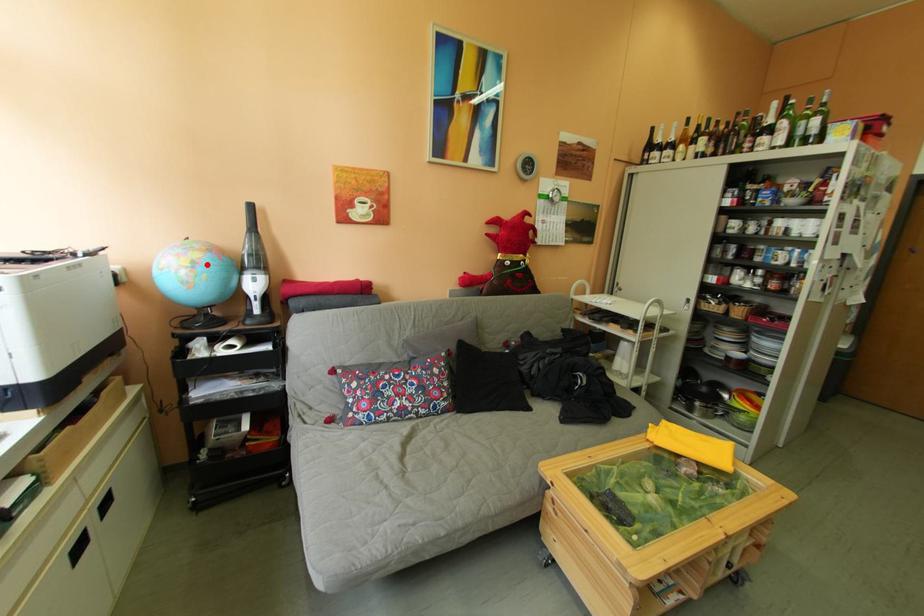
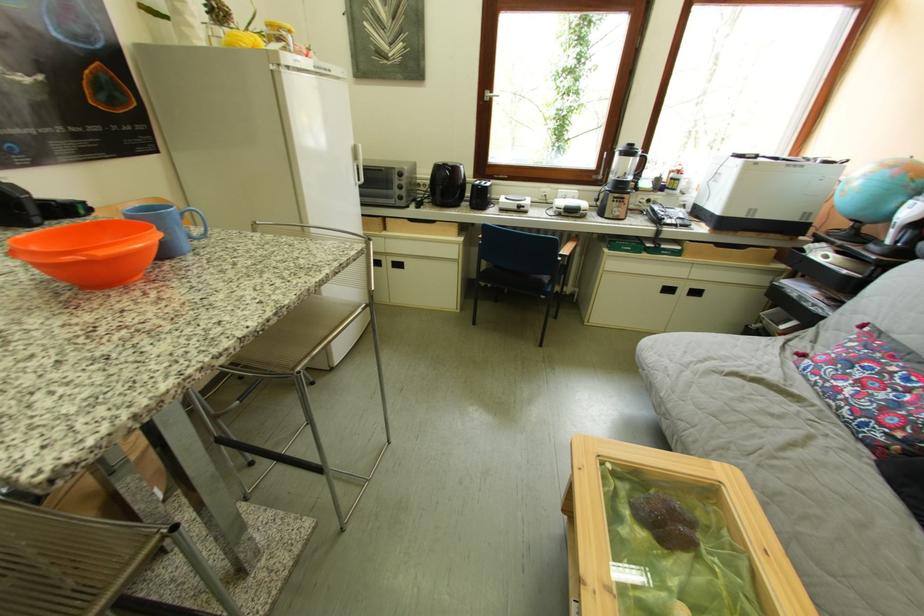
Find the pixel in the second image that matches the highlighted location in the first image.

(877, 177)